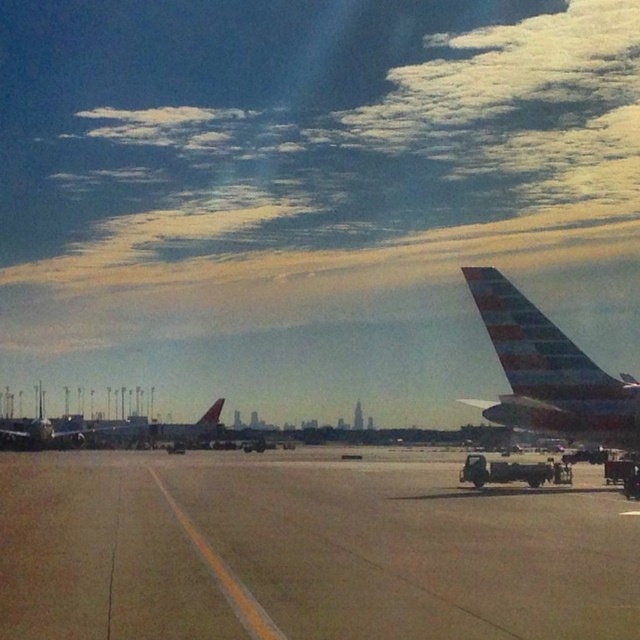
Question: Which point is closer to the camera?

Choices:
 (A) concrete tarmac at center
 (B) metallic silver airplane at left
 (C) polished aluminum airplane wing at right

Answer: (A)

Question: Which point appears farthest from the camera in this image?

Choices:
 (A) (51, 426)
 (B) (317, 476)
 (C) (593, 387)

Answer: (A)

Question: From the image, what is the correct spatial relationship of concrete tarmac at center in relation to metallic silver airplane at left?

Choices:
 (A) left
 (B) right

Answer: (B)

Question: Can you confirm if polished aluminum airplane wing at right is positioned to the left of metallic silver airplane at left?

Choices:
 (A) yes
 (B) no

Answer: (B)

Question: Can you confirm if concrete tarmac at center is wider than metallic silver airplane at left?

Choices:
 (A) no
 (B) yes

Answer: (B)

Question: Which of these objects is positioned closest to the metallic silver airplane at left?

Choices:
 (A) polished aluminum airplane wing at right
 (B) concrete tarmac at center

Answer: (B)